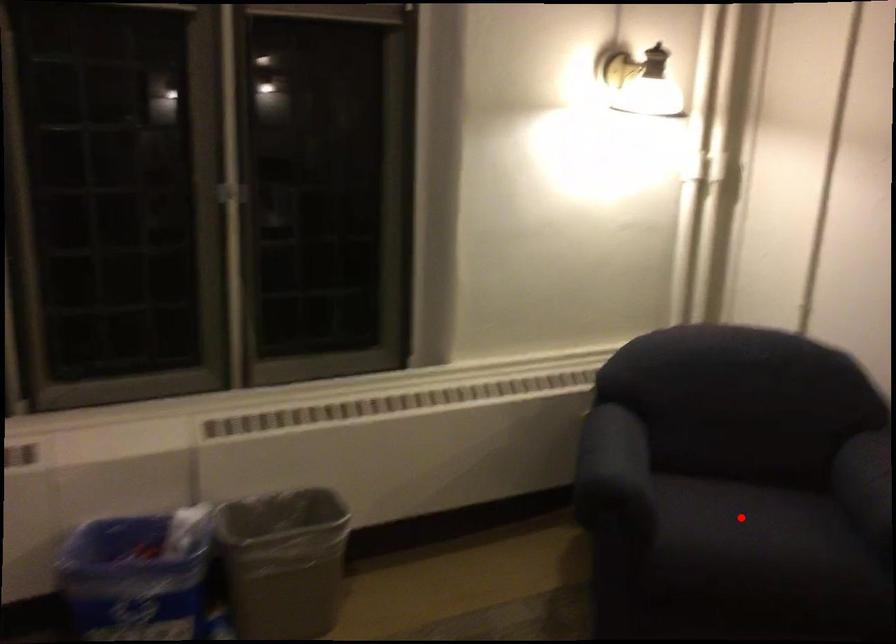
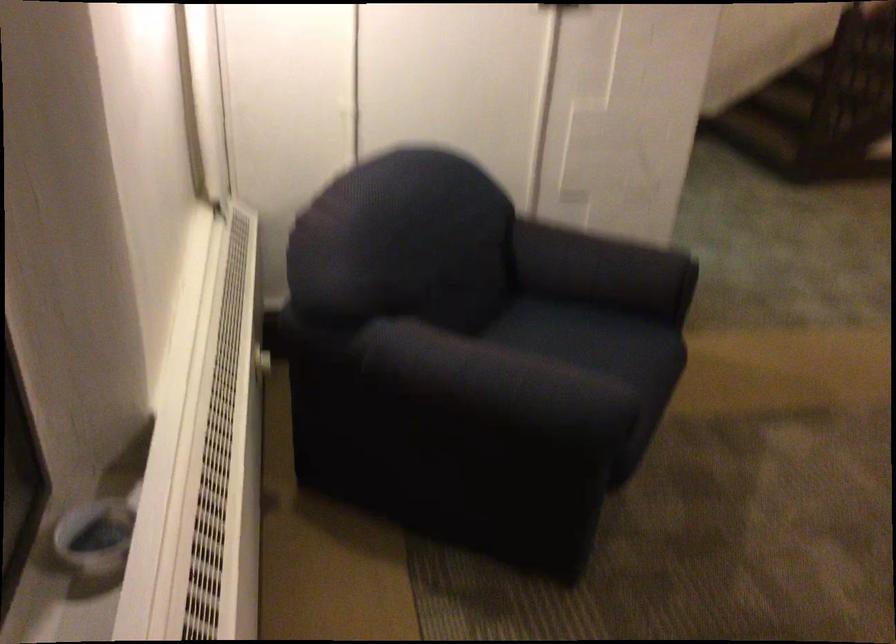
Question: I am providing you with two images of the same scene from different viewpoints. A red point is shown in image1. For the corresponding object point in image2, is it positioned nearer or farther from the camera?

Choices:
 (A) Nearer
 (B) Farther

Answer: (A)